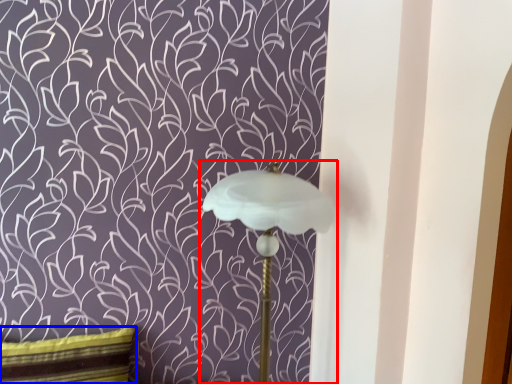
Question: Which object is closer to the camera taking this photo, lamp (highlighted by a red box) or pillow (highlighted by a blue box)?

Choices:
 (A) lamp
 (B) pillow

Answer: (A)